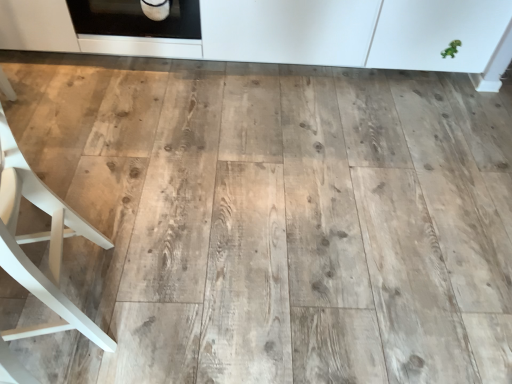
At what (x,y) coordinates should I click in order to perform the action: click on vacant space behind white wood chair at left. Please return your answer as a coordinate pair (x, y). Looking at the image, I should click on (118, 206).